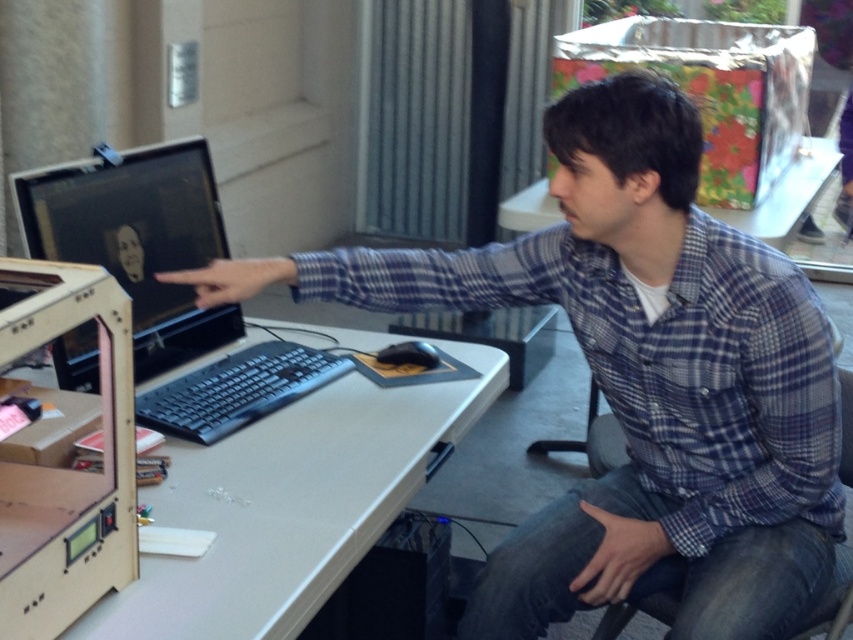
You are a student trying to locate two points on the computer screen. The first point is labeled as point (120, 246) and the second is point (259, 412). According to the scene, which point is closer to the back of the screen?

Point (120, 246) is behind point (259, 412), so the first point is closer to the back of the screen.

What are the coordinates of the plaid shirt at center?

The plaid shirt at center is located at coordinates point [637,380].